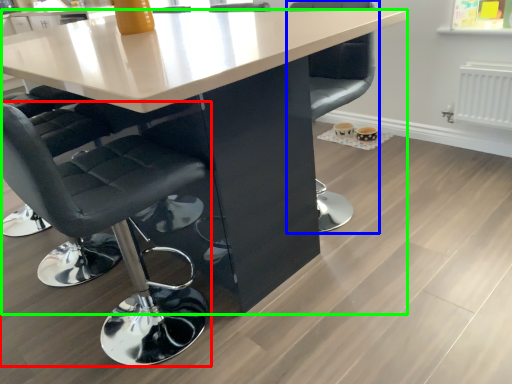
Question: Which object is positioned closest to chair (highlighted by a red box)? Select from chair (highlighted by a blue box) and table (highlighted by a green box).

Choices:
 (A) chair
 (B) table

Answer: (B)